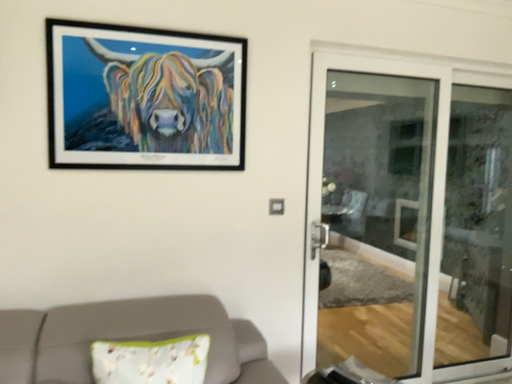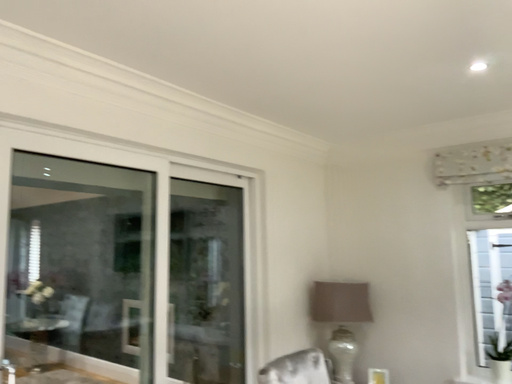
Question: How did the camera likely rotate when shooting the video?

Choices:
 (A) rotated upward
 (B) rotated downward

Answer: (A)